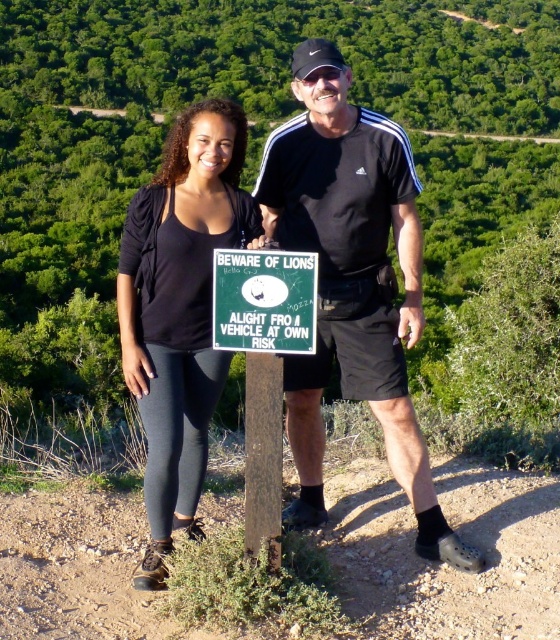
Question: Which of the following is the closest to the observer?

Choices:
 (A) (338, 332)
 (B) (213, 268)
 (C) (144, 296)

Answer: (B)

Question: Is black matte shorts at center wider than green plastic sign at center?

Choices:
 (A) yes
 (B) no

Answer: (A)

Question: Estimate the real-world distances between objects in this image. Which object is closer to the green plastic sign at center?

Choices:
 (A) black fabric top at center
 (B) black matte shorts at center

Answer: (B)

Question: Can you confirm if black matte shorts at center is positioned to the right of black fabric top at center?

Choices:
 (A) no
 (B) yes

Answer: (B)

Question: Is black matte shorts at center to the left of black fabric top at center from the viewer's perspective?

Choices:
 (A) no
 (B) yes

Answer: (A)

Question: Which point is closer to the camera taking this photo?

Choices:
 (A) (245, 250)
 (B) (364, 332)
 (C) (144, 387)

Answer: (A)